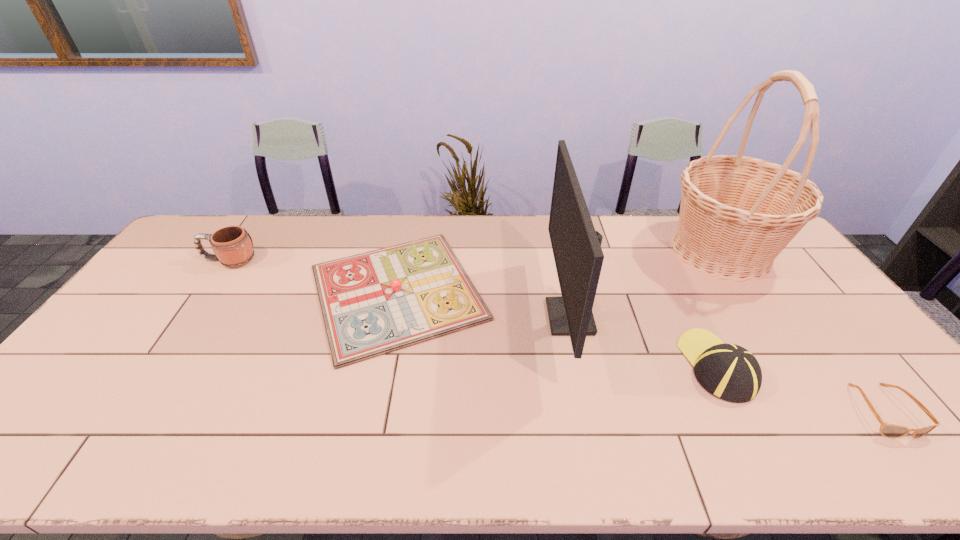
Identify the location of free space that satisfies the following two spatial constraints: 1. on the side of the mug with the handle; 2. with the brim of the baseball cap facing forward. (157, 366).

This screenshot has width=960, height=540. I want to click on vacant point that satisfies the following two spatial constraints: 1. on the front-facing side of the computer monitor; 2. with the brim of the baseball cap facing forward, so click(580, 366).